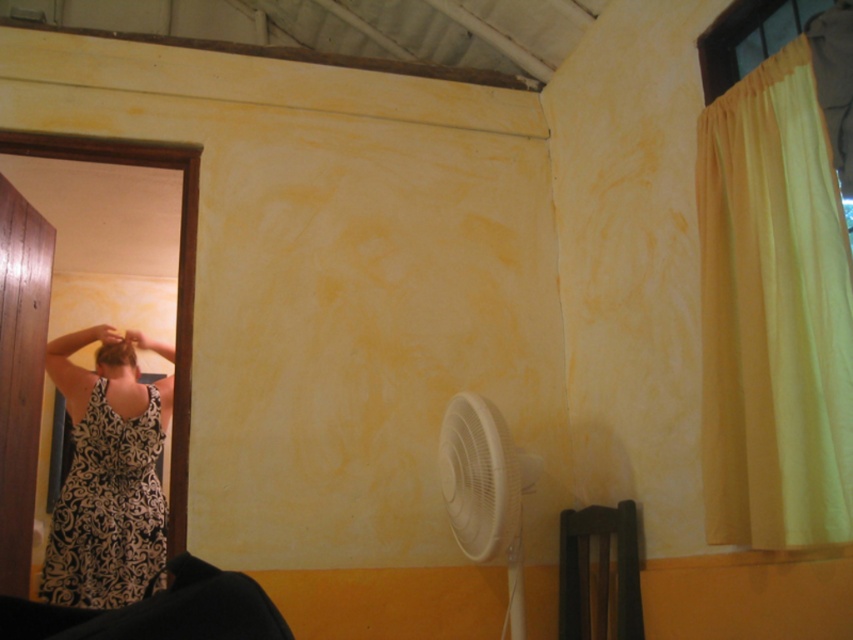
You are standing in the room and want to open the yellow fabric curtain at right to let more light in. However, the white plastic fan at lower center might block your path. Is the curtain above or below the fan?

The yellow fabric curtain at right is located above the white plastic fan at lower center, so it is above the fan.

Based on the scene description, what object is located at the coordinates point (773,314)?

The yellow fabric curtain at right is located at point (773,314).